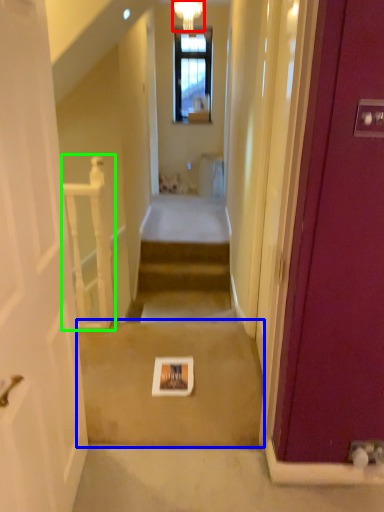
Question: Estimate the real-world distances between objects in this image. Which object is farther from light fixture (highlighted by a red box), path (highlighted by a blue box) or balustrade (highlighted by a green box)?

Choices:
 (A) path
 (B) balustrade

Answer: (A)